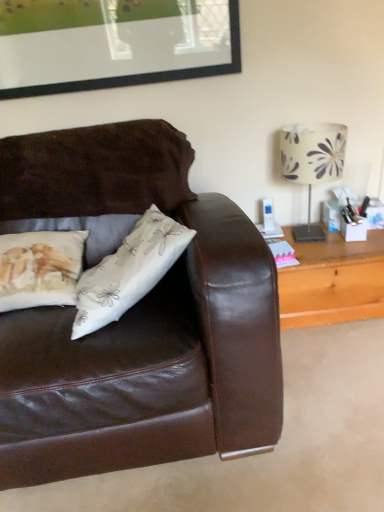
Question: Do you think white floral-patterned lampshade at upper right is within wooden table at right, or outside of it?

Choices:
 (A) inside
 (B) outside

Answer: (B)

Question: Considering the positions of white floral-patterned lampshade at upper right and wooden table at right in the image, is white floral-patterned lampshade at upper right wider or thinner than wooden table at right?

Choices:
 (A) thin
 (B) wide

Answer: (A)

Question: Is point (332, 137) positioned closer to the camera than point (306, 294)?

Choices:
 (A) farther
 (B) closer

Answer: (B)

Question: Is wooden table at right spatially inside white floral-patterned lampshade at upper right, or outside of it?

Choices:
 (A) outside
 (B) inside

Answer: (A)

Question: From the image's perspective, is wooden table at right positioned above or below white floral-patterned lampshade at upper right?

Choices:
 (A) below
 (B) above

Answer: (A)

Question: Is wooden table at right taller or shorter than white floral-patterned lampshade at upper right?

Choices:
 (A) short
 (B) tall

Answer: (A)

Question: Based on their positions, is wooden table at right located to the left or right of white floral-patterned lampshade at upper right?

Choices:
 (A) right
 (B) left

Answer: (A)